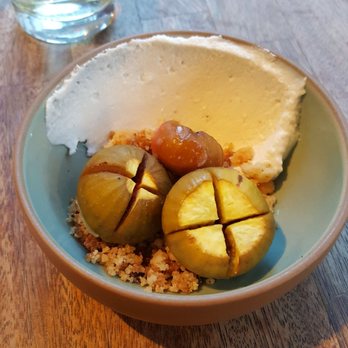
The height and width of the screenshot is (348, 348). What are the coordinates of `dark spot in table` in the screenshot? It's located at (138, 10).